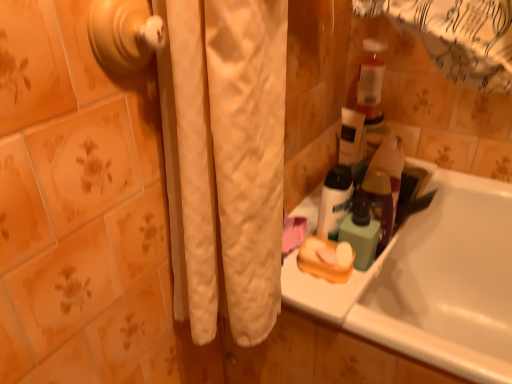
Question: Could you tell me if orange matte soap dish at center is turned towards white plastic sink at lower right?

Choices:
 (A) no
 (B) yes

Answer: (A)

Question: From the image's perspective, is orange matte soap dish at center located above white plastic sink at lower right?

Choices:
 (A) no
 (B) yes

Answer: (A)

Question: Can you confirm if orange matte soap dish at center is thinner than white plastic sink at lower right?

Choices:
 (A) yes
 (B) no

Answer: (A)

Question: From a real-world perspective, is orange matte soap dish at center physically above white plastic sink at lower right?

Choices:
 (A) no
 (B) yes

Answer: (B)

Question: Is orange matte soap dish at center shorter than white plastic sink at lower right?

Choices:
 (A) no
 (B) yes

Answer: (A)

Question: Is orange matte soap dish at center at the right side of white plastic sink at lower right?

Choices:
 (A) yes
 (B) no

Answer: (B)

Question: Does white plastic sink at lower right appear on the left side of white glossy bathtub at lower right?

Choices:
 (A) no
 (B) yes

Answer: (B)

Question: Are white plastic sink at lower right and white glossy bathtub at lower right beside each other?

Choices:
 (A) no
 (B) yes

Answer: (A)

Question: Is white plastic sink at lower right outside white glossy bathtub at lower right?

Choices:
 (A) yes
 (B) no

Answer: (B)

Question: Can you confirm if white plastic sink at lower right is wider than white glossy bathtub at lower right?

Choices:
 (A) no
 (B) yes

Answer: (A)

Question: Is white plastic sink at lower right surrounding white glossy bathtub at lower right?

Choices:
 (A) yes
 (B) no

Answer: (B)

Question: Does white plastic sink at lower right have a larger size compared to white glossy bathtub at lower right?

Choices:
 (A) no
 (B) yes

Answer: (A)

Question: Can you confirm if white matte bottle at upper right is smaller than green matte bottle at upper right?

Choices:
 (A) no
 (B) yes

Answer: (A)